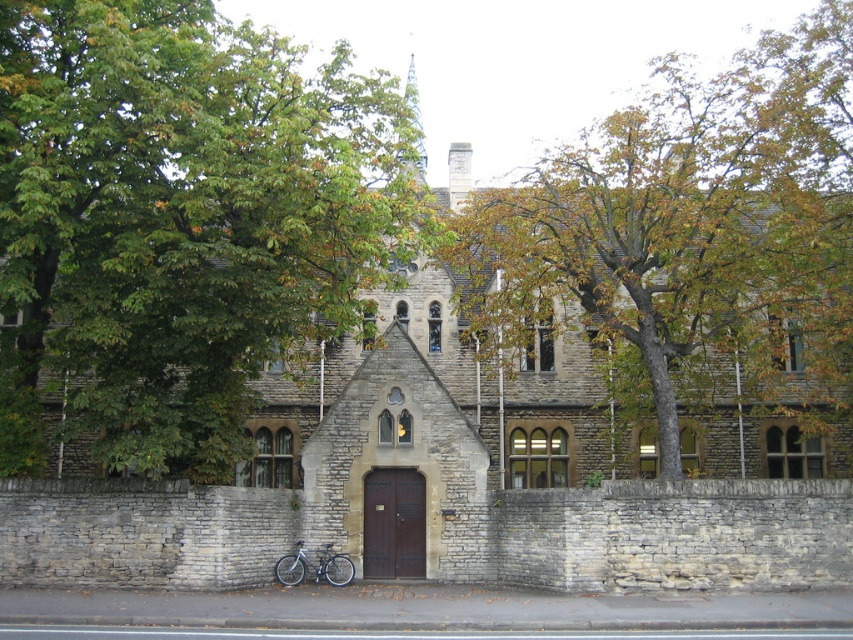
Question: Can you confirm if green leafy tree at upper center is thinner than silver metallic bicycle at lower center?

Choices:
 (A) yes
 (B) no

Answer: (B)

Question: Does green leafy tree at upper center have a larger size compared to stone church at center?

Choices:
 (A) yes
 (B) no

Answer: (A)

Question: Which object is positioned farthest from the green leafy tree at upper center?

Choices:
 (A) silver metallic bicycle at lower center
 (B) stone church at center

Answer: (A)

Question: Which object appears closest to the camera in this image?

Choices:
 (A) silver metallic bicycle at lower center
 (B) stone church at center
 (C) green leafy tree at upper left

Answer: (C)

Question: Which of the following is the closest to the observer?

Choices:
 (A) (347, 572)
 (B) (386, 253)
 (C) (672, 144)
 (D) (726, 548)

Answer: (D)

Question: Can you confirm if green leafy tree at upper left is positioned to the right of green leafy tree at upper center?

Choices:
 (A) no
 (B) yes

Answer: (A)